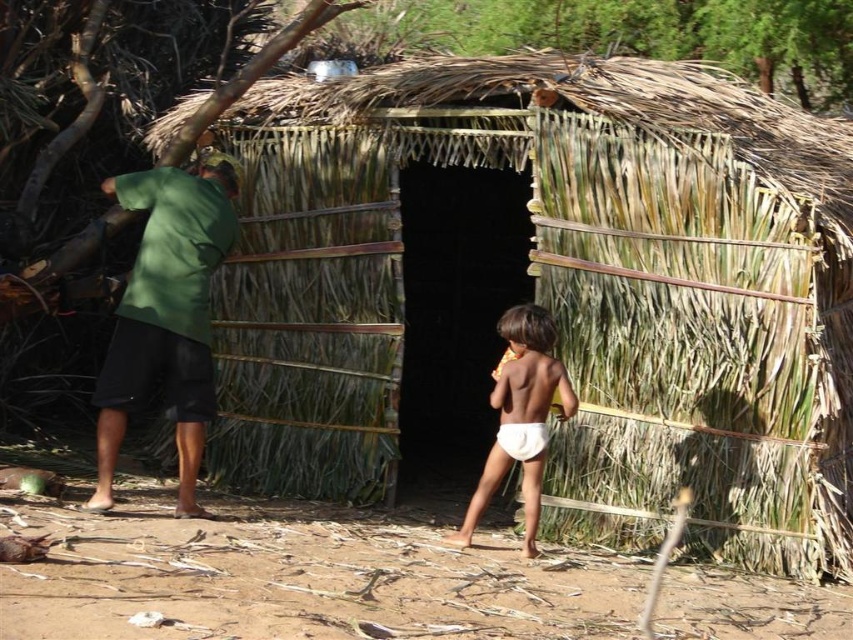
You are standing at the origin point of the coordinate system. You want to move towards the green fabric shirt at left. What direction should you move in?

The green fabric shirt at left is located at coordinate point 0.492 on the x axis and 0.196 on the y axis. Since you are at the origin point, you should move towards the positive x and positive y direction to reach the green fabric shirt at left.

You are a traveler passing by the rustic hut and notice the green fabric shirt at left and the white cloth diaper at center. Which item has a greater width?

The green fabric shirt at left has a greater width than the white cloth diaper at center.